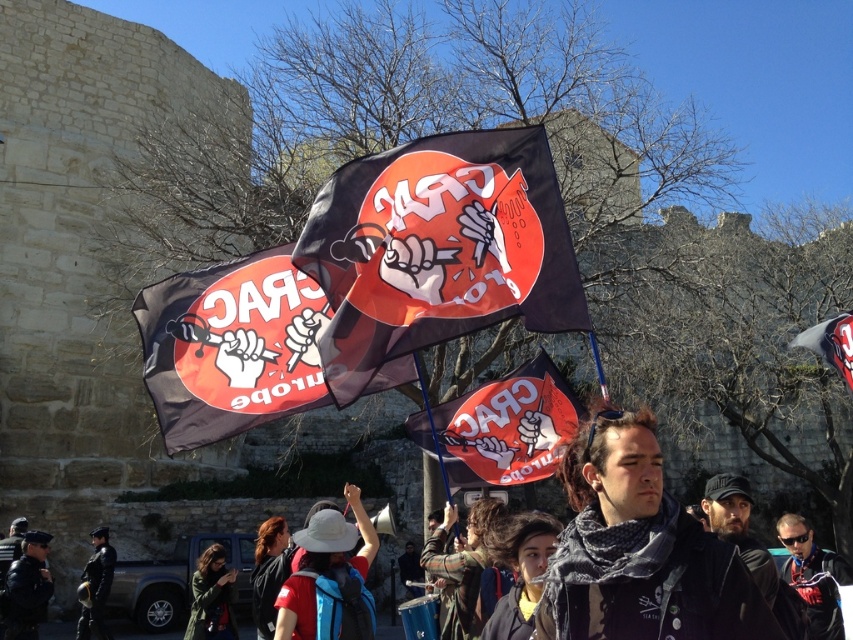
You are a photographer at the protest scene. You notice a flannel shirt at center and a black sunglasses at center. Which item is positioned higher from the ground?

The flannel shirt at center is located above the black sunglasses at center, so the flannel shirt at center is higher.

You are a photographer trying to capture the protest scene. You notice a point at coordinates [502,428]. Which object from the scene does this point belong to?

The point at coordinates [502,428] is on the matte black flag at center.